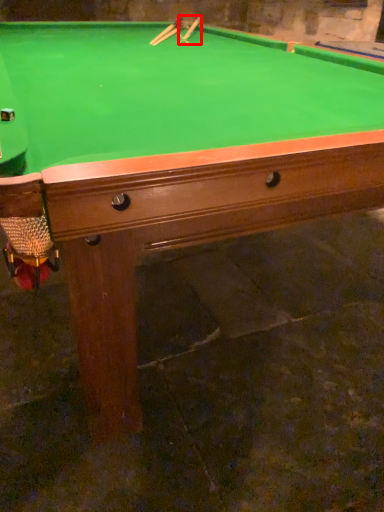
Question: Considering the relative positions of cue (annotated by the red box) and cue in the image provided, where is cue (annotated by the red box) located with respect to the staircase?

Choices:
 (A) left
 (B) right

Answer: (B)